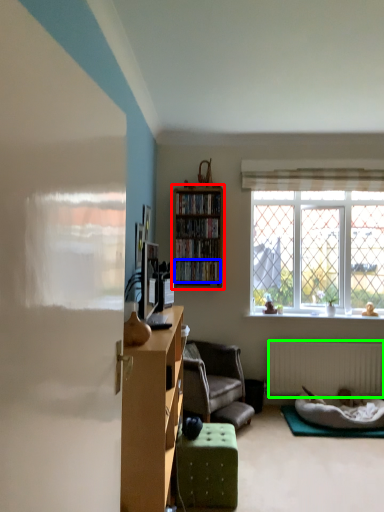
Question: Which object is positioned closest to shelf (highlighted by a red box)? Select from book (highlighted by a blue box) and radiator (highlighted by a green box).

Choices:
 (A) book
 (B) radiator

Answer: (A)